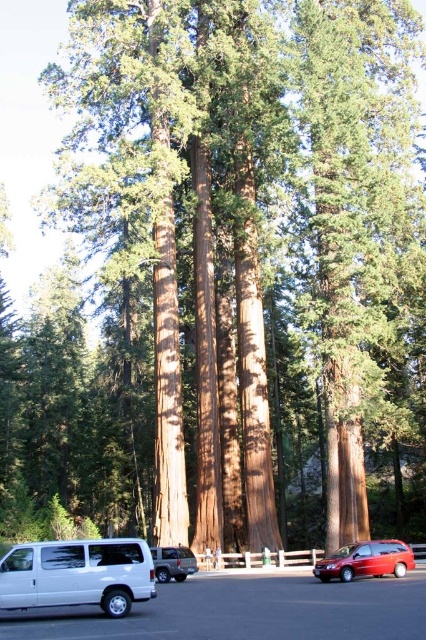
Question: Does white matte van at lower left appear on the left side of shiny red car at lower right?

Choices:
 (A) yes
 (B) no

Answer: (A)

Question: Which object appears farthest from the camera in this image?

Choices:
 (A) white van at center
 (B) white matte van at lower left

Answer: (B)

Question: Does white van at center have a smaller size compared to white matte van at lower left?

Choices:
 (A) yes
 (B) no

Answer: (B)

Question: Which object is closer to the camera taking this photo?

Choices:
 (A) shiny red car at lower right
 (B) metallic silver suv at center
 (C) white matte van at lower left
 (D) white van at center

Answer: (D)

Question: Considering the relative positions of white matte van at lower left and metallic silver suv at center in the image provided, where is white matte van at lower left located with respect to metallic silver suv at center?

Choices:
 (A) above
 (B) below

Answer: (A)

Question: Which object is farther from the camera taking this photo?

Choices:
 (A) white matte van at lower left
 (B) metallic silver suv at center
 (C) white van at center
 (D) shiny red car at lower right

Answer: (B)